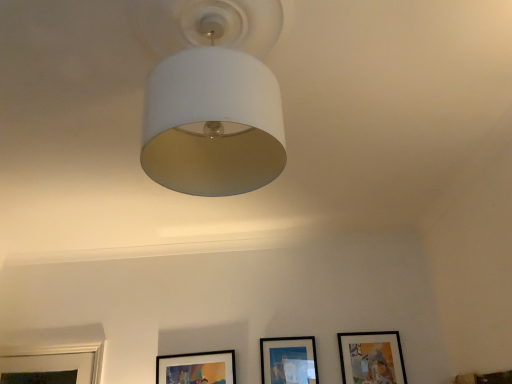
What is the approximate height of matte black picture frame at lower right, which ranks as the first picture frame in right-to-left order?

matte black picture frame at lower right, which ranks as the first picture frame in right-to-left order, is 14.77 inches tall.

In order to click on matte black picture frame at lower right, positioned as the 3th picture frame in left-to-right order in this screenshot , I will do `click(371, 358)`.

Looking at this image, who is bigger, matte black picture frame at lower center, marked as the 1th picture frame in a left-to-right arrangement, or white matte lampshade at upper center?

Bigger between the two is white matte lampshade at upper center.

Does point (182, 364) lie behind point (252, 94)?

Yes, point (182, 364) is behind point (252, 94).

Is matte black picture frame at lower center, marked as the 1th picture frame in a left-to-right arrangement, far from white matte lampshade at upper center?

Yes, matte black picture frame at lower center, marked as the 1th picture frame in a left-to-right arrangement, and white matte lampshade at upper center are located far from each other.

Considering the relative positions of matte black picture frame at lower center, marked as the 1th picture frame in a left-to-right arrangement, and white matte lampshade at upper center in the image provided, is matte black picture frame at lower center, marked as the 1th picture frame in a left-to-right arrangement, to the left or to the right of white matte lampshade at upper center?

Based on their positions, matte black picture frame at lower center, marked as the 1th picture frame in a left-to-right arrangement, is located to the left of white matte lampshade at upper center.

From the image's perspective, between white matte lampshade at upper center and matte black picture frame at center, the 2th picture frame in the right-to-left sequence, which one is located above?

white matte lampshade at upper center.

Is white matte lampshade at upper center surrounding matte black picture frame at center, the 2th picture frame in the right-to-left sequence?

No, white matte lampshade at upper center does not contain matte black picture frame at center, the 2th picture frame in the right-to-left sequence.

Are white matte lampshade at upper center and matte black picture frame at center, the 2th picture frame in the right-to-left sequence, beside each other?

No, white matte lampshade at upper center is not touching matte black picture frame at center, the 2th picture frame in the right-to-left sequence.

Based on the photo, between matte black picture frame at lower center, which is counted as the 3th picture frame, starting from the right, and matte black picture frame at center, the 2th picture frame in the right-to-left sequence, which one has less height?

Standing shorter between the two is matte black picture frame at lower center, which is counted as the 3th picture frame, starting from the right.

Is matte black picture frame at lower center, which is counted as the 3th picture frame, starting from the right, oriented towards matte black picture frame at center, the 2th picture frame in the right-to-left sequence?

No, matte black picture frame at lower center, which is counted as the 3th picture frame, starting from the right, is not oriented towards matte black picture frame at center, the 2th picture frame in the right-to-left sequence.

Would you say matte black picture frame at lower right, positioned as the 3th picture frame in left-to-right order, is to the left or to the right of matte black picture frame at lower center, marked as the 1th picture frame in a left-to-right arrangement, in the picture?

Based on their positions, matte black picture frame at lower right, positioned as the 3th picture frame in left-to-right order, is located to the right of matte black picture frame at lower center, marked as the 1th picture frame in a left-to-right arrangement.

Is matte black picture frame at lower right, which ranks as the first picture frame in right-to-left order, positioned far away from matte black picture frame at lower center, which is counted as the 3th picture frame, starting from the right?

Yes, matte black picture frame at lower right, which ranks as the first picture frame in right-to-left order, is far from matte black picture frame at lower center, which is counted as the 3th picture frame, starting from the right.

Consider the image. From the image's perspective, is matte black picture frame at lower right, positioned as the 3th picture frame in left-to-right order, below matte black picture frame at lower center, marked as the 1th picture frame in a left-to-right arrangement?

No, from the image's perspective, matte black picture frame at lower right, positioned as the 3th picture frame in left-to-right order, is not beneath matte black picture frame at lower center, marked as the 1th picture frame in a left-to-right arrangement.

Considering the sizes of objects matte black picture frame at lower right, positioned as the 3th picture frame in left-to-right order, and matte black picture frame at lower center, which is counted as the 3th picture frame, starting from the right, in the image provided, who is taller, matte black picture frame at lower right, positioned as the 3th picture frame in left-to-right order, or matte black picture frame at lower center, which is counted as the 3th picture frame, starting from the right,?

With more height is matte black picture frame at lower right, positioned as the 3th picture frame in left-to-right order.

Is white matte lampshade at upper center facing towards matte black picture frame at lower right, which ranks as the first picture frame in right-to-left order?

No, white matte lampshade at upper center is not aimed at matte black picture frame at lower right, which ranks as the first picture frame in right-to-left order.

Can you confirm if white matte lampshade at upper center is thinner than matte black picture frame at lower right, positioned as the 3th picture frame in left-to-right order?

No.

From a real-world perspective, is white matte lampshade at upper center on top of matte black picture frame at lower right, which ranks as the first picture frame in right-to-left order?

Yes.

Is white matte lampshade at upper center not within matte black picture frame at lower right, positioned as the 3th picture frame in left-to-right order?

Yes, white matte lampshade at upper center is located beyond the bounds of matte black picture frame at lower right, positioned as the 3th picture frame in left-to-right order.

From the image's perspective, which is below, matte black picture frame at lower center, marked as the 1th picture frame in a left-to-right arrangement, or matte black picture frame at lower right, which ranks as the first picture frame in right-to-left order?

matte black picture frame at lower center, marked as the 1th picture frame in a left-to-right arrangement, appears lower in the image.

You are a GUI agent. You are given a task and a screenshot of the screen. Output one action in this format:
    pyautogui.click(x=<x>, y=<y>)
    Task: Click on the picture frame below the matte black picture frame at lower right, which ranks as the first picture frame in right-to-left order (from a real-world perspective)
    
    Given the screenshot: What is the action you would take?
    pyautogui.click(x=197, y=368)

Considering the positions of points (181, 377) and (368, 361), is point (181, 377) closer to camera compared to point (368, 361)?

Yes, it is in front of point (368, 361).

Is matte black picture frame at lower right, positioned as the 3th picture frame in left-to-right order, not close to matte black picture frame at center, the 2th picture frame in the right-to-left sequence?

They are positioned close to each other.

Does matte black picture frame at lower right, positioned as the 3th picture frame in left-to-right order, lie in front of matte black picture frame at center, the 2th picture frame positioned from the left?

Yes, matte black picture frame at lower right, positioned as the 3th picture frame in left-to-right order, is in front of matte black picture frame at center, the 2th picture frame positioned from the left.

What's the angular difference between matte black picture frame at lower right, which ranks as the first picture frame in right-to-left order, and matte black picture frame at center, the 2th picture frame positioned from the left,'s facing directions?

There is a 0.00896-degree angle between the facing directions of matte black picture frame at lower right, which ranks as the first picture frame in right-to-left order, and matte black picture frame at center, the 2th picture frame positioned from the left.

Which of these two, matte black picture frame at lower right, which ranks as the first picture frame in right-to-left order, or matte black picture frame at center, the 2th picture frame positioned from the left, is smaller?

matte black picture frame at center, the 2th picture frame positioned from the left, is smaller.

In order to click on picture frame lying on the left of white matte lampshade at upper center in this screenshot , I will do `click(197, 368)`.

From the image's perspective, starting from the white matte lampshade at upper center, which picture frame is the 2nd one below? Please provide its 2D coordinates.

[(288, 360)]

Looking at the image, which one is located closer to white matte lampshade at upper center, matte black picture frame at lower center, which is counted as the 3th picture frame, starting from the right, or matte black picture frame at lower right, positioned as the 3th picture frame in left-to-right order?

matte black picture frame at lower center, which is counted as the 3th picture frame, starting from the right, is positioned closer to the anchor white matte lampshade at upper center.

From the image, which object appears to be farther from matte black picture frame at lower center, marked as the 1th picture frame in a left-to-right arrangement, white matte lampshade at upper center or matte black picture frame at center, the 2th picture frame in the right-to-left sequence?

Among the two, white matte lampshade at upper center is located further to matte black picture frame at lower center, marked as the 1th picture frame in a left-to-right arrangement.

Which object lies nearer to the anchor point white matte lampshade at upper center, matte black picture frame at center, the 2th picture frame in the right-to-left sequence, or matte black picture frame at lower right, positioned as the 3th picture frame in left-to-right order?

matte black picture frame at center, the 2th picture frame in the right-to-left sequence, is closer to white matte lampshade at upper center.

Which object lies nearer to the anchor point matte black picture frame at center, the 2th picture frame positioned from the left, matte black picture frame at lower right, positioned as the 3th picture frame in left-to-right order, or white matte lampshade at upper center?

matte black picture frame at lower right, positioned as the 3th picture frame in left-to-right order.

Which object lies nearer to the anchor point matte black picture frame at center, the 2th picture frame in the right-to-left sequence, matte black picture frame at lower right, positioned as the 3th picture frame in left-to-right order, or matte black picture frame at lower center, marked as the 1th picture frame in a left-to-right arrangement?

matte black picture frame at lower right, positioned as the 3th picture frame in left-to-right order, is closer to matte black picture frame at center, the 2th picture frame in the right-to-left sequence.

When comparing their distances from matte black picture frame at lower center, marked as the 1th picture frame in a left-to-right arrangement, does matte black picture frame at center, the 2th picture frame in the right-to-left sequence, or white matte lampshade at upper center seem further?

white matte lampshade at upper center is further to matte black picture frame at lower center, marked as the 1th picture frame in a left-to-right arrangement.

Looking at the image, which one is located further to matte black picture frame at center, the 2th picture frame positioned from the left, matte black picture frame at lower center, which is counted as the 3th picture frame, starting from the right, or matte black picture frame at lower right, which ranks as the first picture frame in right-to-left order?

Among the two, matte black picture frame at lower center, which is counted as the 3th picture frame, starting from the right, is located further to matte black picture frame at center, the 2th picture frame positioned from the left.

Looking at the image, which one is located further to matte black picture frame at center, the 2th picture frame positioned from the left, white matte lampshade at upper center or matte black picture frame at lower center, marked as the 1th picture frame in a left-to-right arrangement?

white matte lampshade at upper center.

You are a GUI agent. You are given a task and a screenshot of the screen. Output one action in this format:
    pyautogui.click(x=<x>, y=<y>)
    Task: Click on the picture frame between white matte lampshade at upper center and matte black picture frame at center, the 2th picture frame positioned from the left, from front to back
    
    Given the screenshot: What is the action you would take?
    pyautogui.click(x=371, y=358)

Find the location of a particular element. picture frame between matte black picture frame at lower center, which is counted as the 3th picture frame, starting from the right, and matte black picture frame at lower right, positioned as the 3th picture frame in left-to-right order, from left to right is located at coordinates (288, 360).